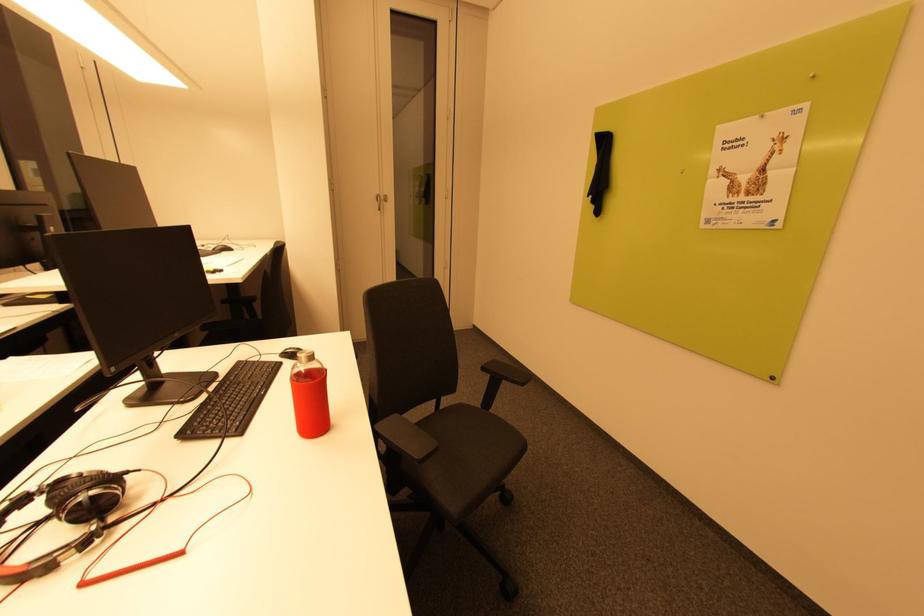
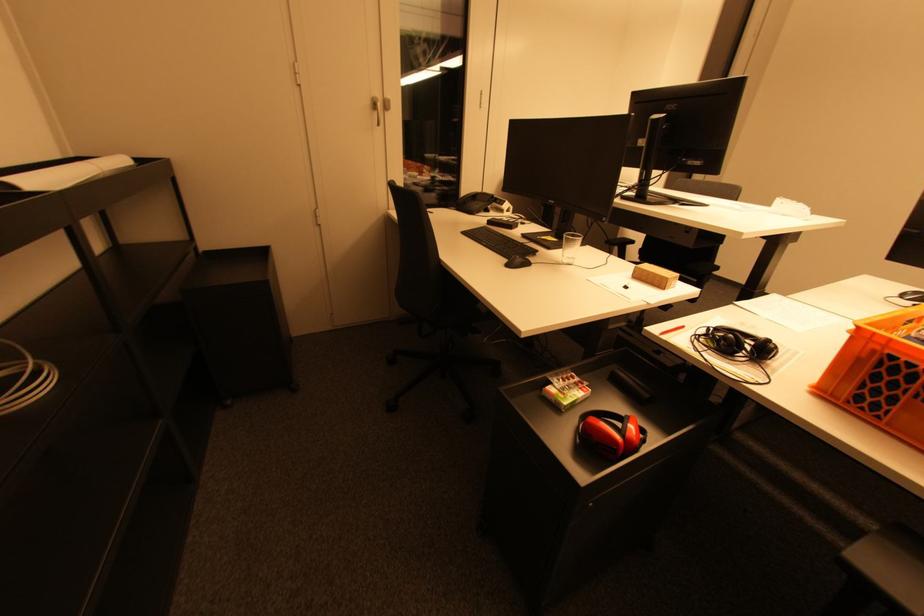
Question: Which direction would the cameraman need to move to produce the second image? Reply with the corresponding letter.

Choices:
 (A) Left
 (B) Right
 (C) Forward
 (D) Backward

Answer: (A)